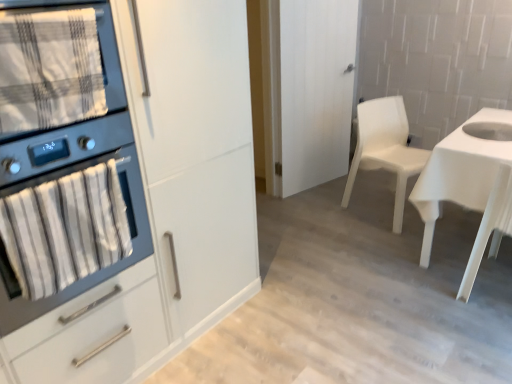
The height and width of the screenshot is (384, 512). What are the coordinates of `free spot below white matte door at center (from a real-world perspective)` in the screenshot? It's located at (315, 182).